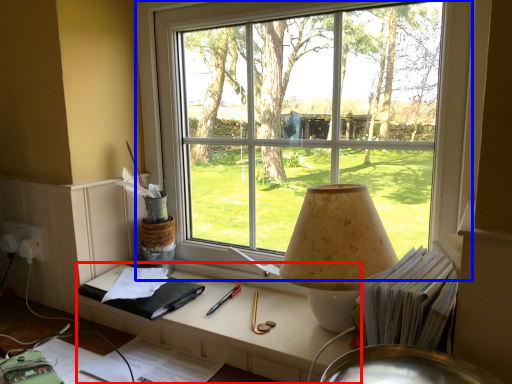
Question: Which point is closer to the camera, table (highlighted by a red box) or window (highlighted by a blue box)?

Choices:
 (A) table
 (B) window

Answer: (B)